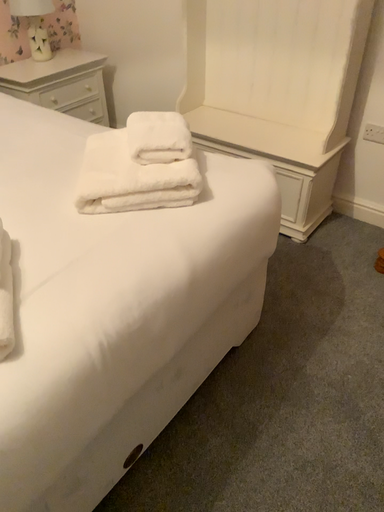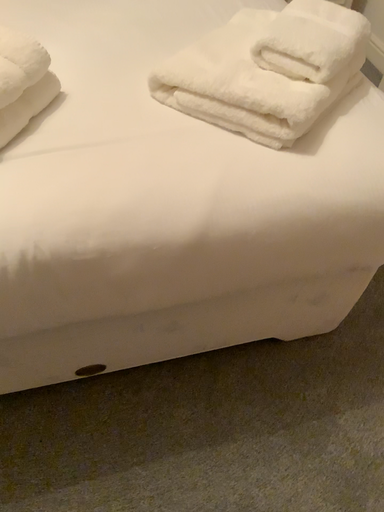
Question: Which way did the camera rotate in the video?

Choices:
 (A) rotated left
 (B) rotated right

Answer: (A)